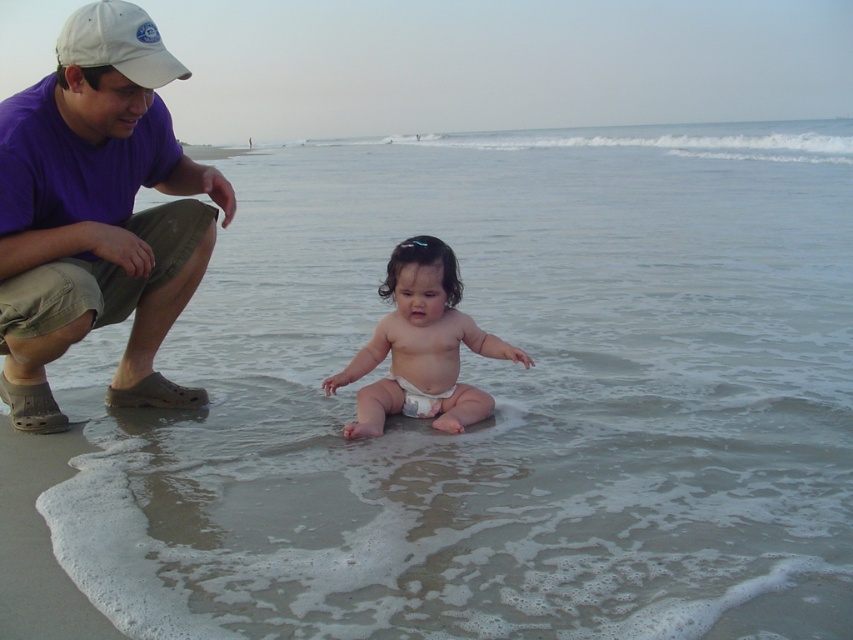
Does purple cotton shirt at upper left have a smaller size compared to white fabric cap at upper left?

Incorrect, purple cotton shirt at upper left is not smaller in size than white fabric cap at upper left.

Measure the distance between point (61,280) and camera.

They are 2.58 meters apart.

Is point (167, 224) less distant than point (112, 17)?

That is False.

Locate an element on the screen. This screenshot has height=640, width=853. purple cotton shirt at upper left is located at coordinates pos(97,212).

Is white diaper toddler at center above white fabric cap at upper left?

Incorrect, white diaper toddler at center is not positioned above white fabric cap at upper left.

Does white diaper toddler at center have a greater height compared to white fabric cap at upper left?

Yes, white diaper toddler at center is taller than white fabric cap at upper left.

Is point (431, 314) closer to viewer compared to point (149, 45)?

No, (431, 314) is behind (149, 45).

Find the location of a particular element. white diaper toddler at center is located at coordinates (421, 346).

Who is positioned more to the left, white diaper toddler at center or white cloth diaper at center?

white cloth diaper at center

Is point (428, 371) less distant than point (439, 403)?

That is True.

Locate an element on the screen. Image resolution: width=853 pixels, height=640 pixels. white diaper toddler at center is located at coordinates (421, 346).

In order to click on white diaper toddler at center in this screenshot , I will do `click(421, 346)`.